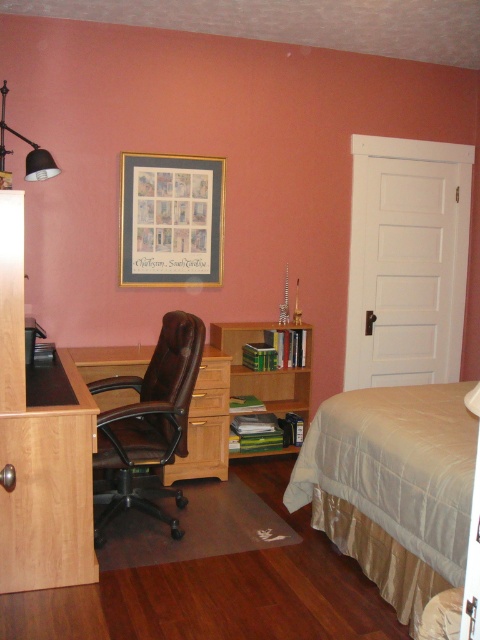
You are an interior designer assessing the bedroom layout. The matte paper picture frame at upper center and the wooden drawer at center are both in the room. Which object has a greater height?

The matte paper picture frame at upper center is much taller than the wooden drawer at center, so it has a greater height.

Based on the photo, you are an interior designer assessing the bedroom layout. You need to determine if the matte paper picture frame at upper center is positioned above the wooden bookshelf at center. Can you confirm this?

Yes, the matte paper picture frame at upper center is located above the wooden bookshelf at center as stated in the description.

You are standing at the entrance of the bedroom and want to reach the beige satin bed at lower right. According to the coordinates provided, in which direction should you move from your current position?

The beige satin bed at lower right is located at coordinates point (393, 486), which is in the lower right area of the room. Therefore, you should move towards the lower right direction from the entrance to reach it.